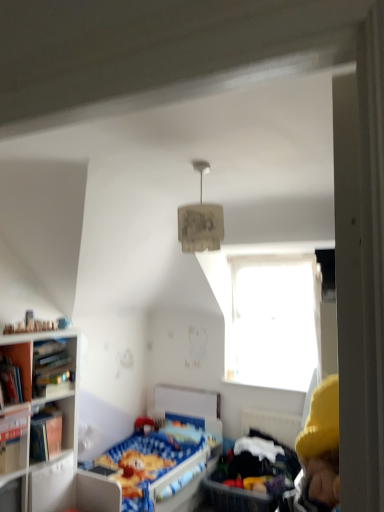
This screenshot has height=512, width=384. I want to click on free space above transparent glass window at upper center (from a real-world perspective), so click(263, 258).